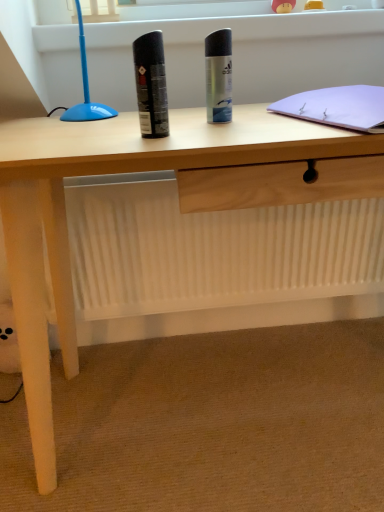
Question: Looking at their shapes, would you say black matte can at center, the 2th stationery viewed from the back, is wider or thinner than silver metallic deodorant can at center, arranged as the second stationery when viewed from the front?

Choices:
 (A) thin
 (B) wide

Answer: (A)

Question: From a real-world perspective, is black matte can at center, positioned as the first stationery in left-to-right order, above or below silver metallic deodorant can at center, arranged as the first stationery when viewed from the right?

Choices:
 (A) above
 (B) below

Answer: (A)

Question: Based on their relative distances, which object is farther from the white paper notebook at upper right?

Choices:
 (A) black matte can at center, which is the first stationery in front-to-back order
 (B) silver metallic deodorant can at center, the 2th stationery in the left-to-right sequence

Answer: (A)

Question: Which of these objects is positioned closest to the silver metallic deodorant can at center, arranged as the second stationery when viewed from the front?

Choices:
 (A) white paper notebook at upper right
 (B) black matte can at center, which is the first stationery in front-to-back order

Answer: (B)